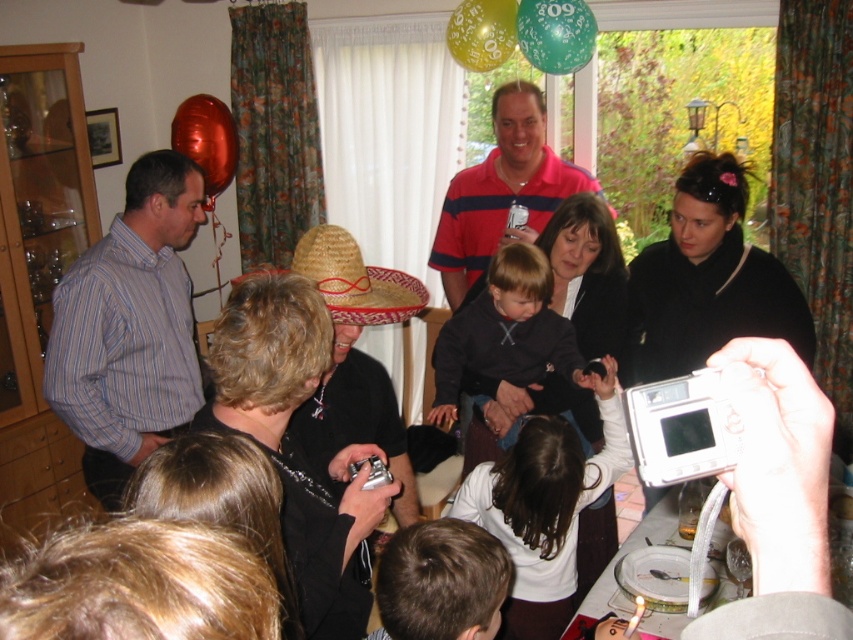
At the birthday celebration, you see a striped cotton shirt at left and a dark blue sweater at center. Which clothing item is positioned more to the left?

The striped cotton shirt at left is positioned more to the left than the dark blue sweater at center.

You are at the birthday celebration and want to take a photo of the two points mentioned. Which point is closer to you, point (550, 627) or point (444, 400)?

Point (550, 627) is in front of point (444, 400), so it is closer to you.

You are standing in the room and want to take a photo of the point at coordinates (157, 301). If your camera has a maximum focus range of 9 feet, will it be able to focus on that point?

The point at coordinates (157, 301) is 8.95 feet away from the viewer, so yes, the camera can focus on it since the distance is within the maximum focus range of 9 feet.